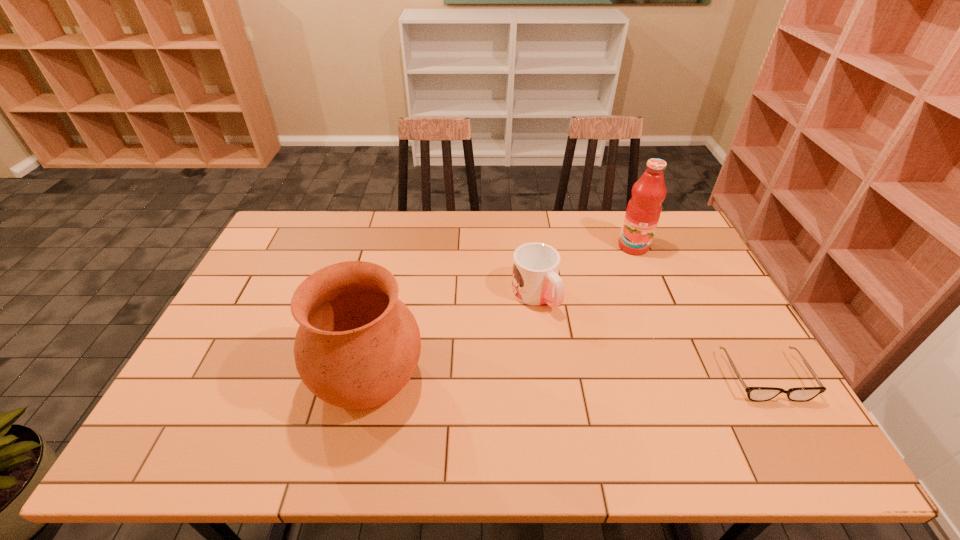
Find the location of a particular element. Image resolution: width=960 pixels, height=540 pixels. the leftmost object is located at coordinates (357, 346).

Image resolution: width=960 pixels, height=540 pixels. I want to click on spectacles, so click(758, 394).

Where is `the shortest object`? the shortest object is located at coordinates (758, 394).

Identify the location of the farthest object. (643, 211).

Locate an element on the screen. This screenshot has height=540, width=960. the third object from left to right is located at coordinates (643, 211).

You are a GUI agent. You are given a task and a screenshot of the screen. Output one action in this format:
    pyautogui.click(x=<x>, y=<y>)
    Task: Click on the second object from left to right
    
    Given the screenshot: What is the action you would take?
    pyautogui.click(x=535, y=281)

The height and width of the screenshot is (540, 960). In order to click on the third tallest object in this screenshot , I will do `click(535, 281)`.

Image resolution: width=960 pixels, height=540 pixels. I want to click on vacant space located 0.070m on the back of the leftmost object, so click(x=382, y=315).

The height and width of the screenshot is (540, 960). I want to click on blank space located on the front label of the farthest object, so coord(628,325).

Locate an element on the screen. vacant space located 0.210m on the front label of the farthest object is located at coordinates (630, 298).